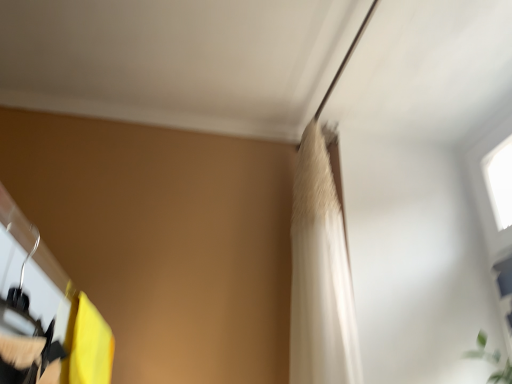
Question: Considering the relative positions of matte black hanger at left and yellow fabric curtain at lower left in the image provided, is matte black hanger at left to the left or to the right of yellow fabric curtain at lower left?

Choices:
 (A) left
 (B) right

Answer: (B)

Question: From a real-world perspective, relative to yellow fabric curtain at lower left, is matte black hanger at left vertically above or below?

Choices:
 (A) above
 (B) below

Answer: (B)

Question: Which of these objects is positioned farthest from the matte black hanger at left?

Choices:
 (A) white fabric shower curtain at upper center
 (B) yellow fabric curtain at lower left

Answer: (A)

Question: Based on their relative distances, which object is farther from the white fabric shower curtain at upper center?

Choices:
 (A) yellow fabric curtain at lower left
 (B) matte black hanger at left

Answer: (B)